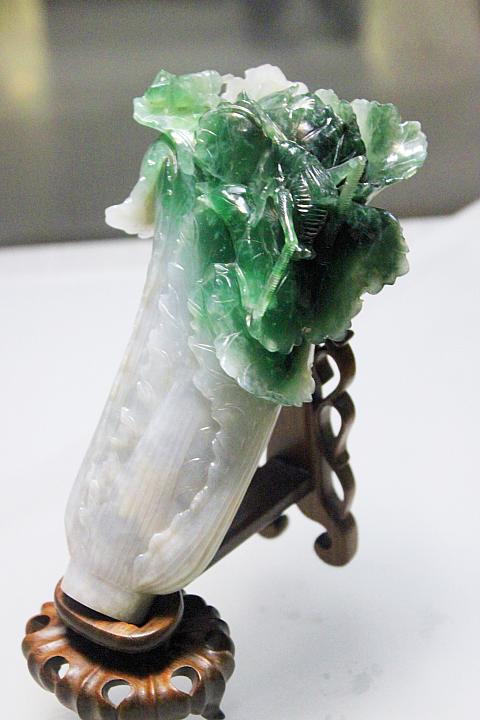
The width and height of the screenshot is (480, 720). What are the coordinates of `wooden base or stand left lower corner` in the screenshot? It's located at (98, 669).